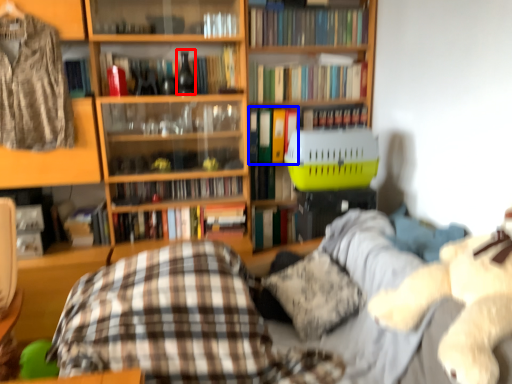
Question: Which of the following is the closest to the observer, wine bottle (highlighted by a red box) or book (highlighted by a blue box)?

Choices:
 (A) wine bottle
 (B) book

Answer: (A)